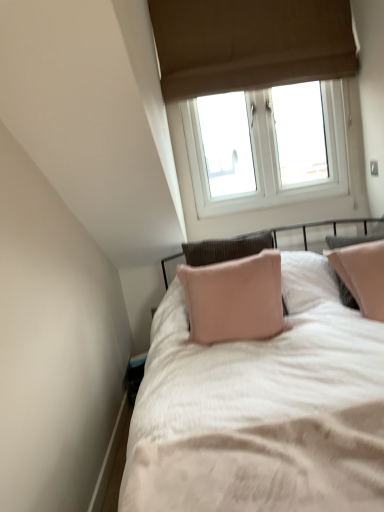
Locate an element on the screen. The width and height of the screenshot is (384, 512). white plastic window at upper center is located at coordinates (266, 147).

What do you see at coordinates (266, 147) in the screenshot? The height and width of the screenshot is (512, 384). I see `white plastic window at upper center` at bounding box center [266, 147].

Locate an element on the screen. The width and height of the screenshot is (384, 512). white plastic window at upper center is located at coordinates 266,147.